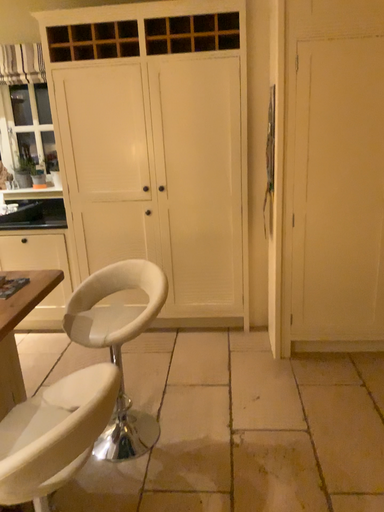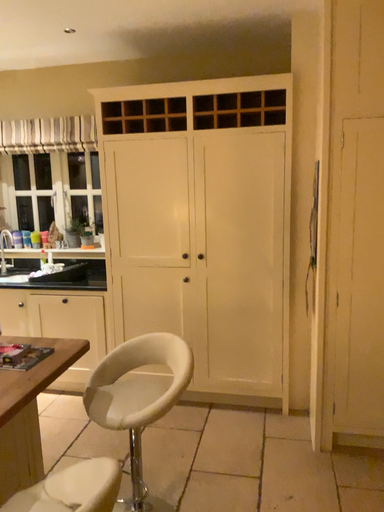
Question: Which way did the camera rotate in the video?

Choices:
 (A) rotated left
 (B) rotated right

Answer: (A)